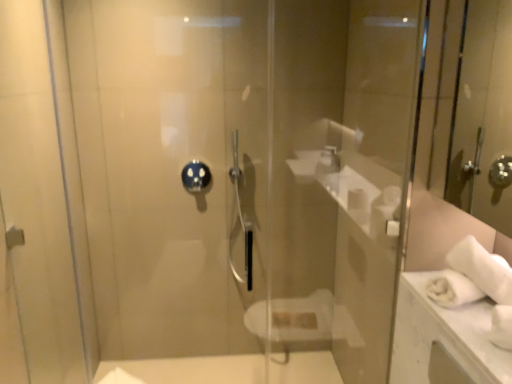
Question: Would you say blue glossy showerhead at center is outside transparent glass door at center?

Choices:
 (A) no
 (B) yes

Answer: (B)

Question: From a real-world perspective, is blue glossy showerhead at center physically below transparent glass door at center?

Choices:
 (A) no
 (B) yes

Answer: (B)

Question: From the image's perspective, would you say blue glossy showerhead at center is shown under transparent glass door at center?

Choices:
 (A) no
 (B) yes

Answer: (A)

Question: Does blue glossy showerhead at center contain transparent glass door at center?

Choices:
 (A) yes
 (B) no

Answer: (B)

Question: Could you tell me if blue glossy showerhead at center is facing transparent glass door at center?

Choices:
 (A) no
 (B) yes

Answer: (A)

Question: In the image, is blue glossy showerhead at center on the left side or the right side of transparent glass screen door at left?

Choices:
 (A) left
 (B) right

Answer: (B)

Question: Considering the positions of blue glossy showerhead at center and transparent glass screen door at left in the image, is blue glossy showerhead at center taller or shorter than transparent glass screen door at left?

Choices:
 (A) short
 (B) tall

Answer: (A)

Question: From the image's perspective, relative to transparent glass screen door at left, is blue glossy showerhead at center above or below?

Choices:
 (A) above
 (B) below

Answer: (A)

Question: From a real-world perspective, is blue glossy showerhead at center above or below transparent glass screen door at left?

Choices:
 (A) below
 (B) above

Answer: (A)

Question: From the image's perspective, relative to blue glossy showerhead at center, is transparent glass screen door at left above or below?

Choices:
 (A) below
 (B) above

Answer: (A)

Question: Considering the positions of point (3, 33) and point (198, 170), is point (3, 33) closer or farther from the camera than point (198, 170)?

Choices:
 (A) farther
 (B) closer

Answer: (A)

Question: Is transparent glass screen door at left wider or thinner than blue glossy showerhead at center?

Choices:
 (A) wide
 (B) thin

Answer: (A)

Question: Is transparent glass screen door at left taller or shorter than blue glossy showerhead at center?

Choices:
 (A) short
 (B) tall

Answer: (B)

Question: Do you think blue glossy showerhead at center is within transparent glass door at center, or outside of it?

Choices:
 (A) outside
 (B) inside

Answer: (A)

Question: From a real-world perspective, is blue glossy showerhead at center above or below transparent glass door at center?

Choices:
 (A) below
 (B) above

Answer: (A)